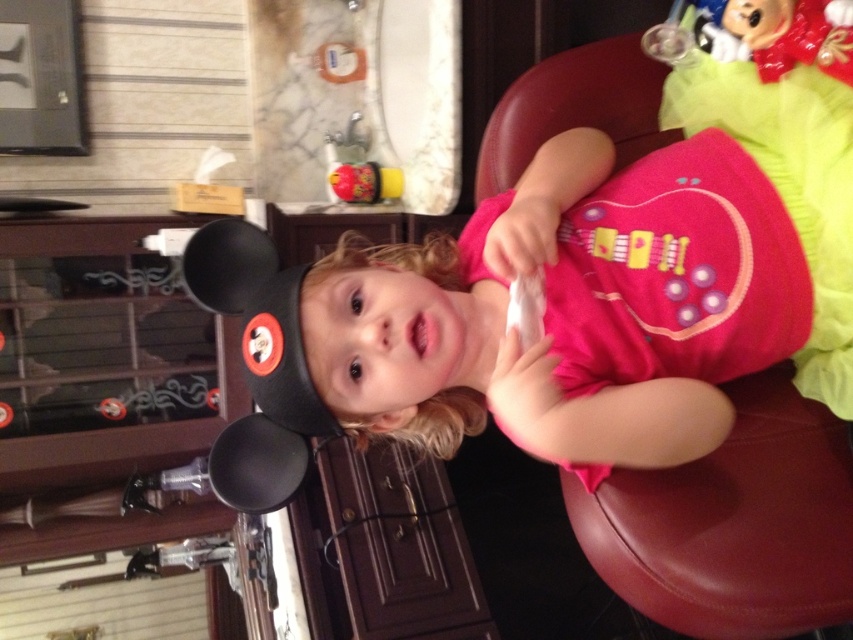
You are designing a layout for a childrens playroom. You have a leather at right and a shiny plastic toy at center. Which object requires more horizontal space to accommodate its width?

The leather at right requires more horizontal space because its width surpasses that of the shiny plastic toy at center.

Based on the scene description, can you determine if the leather at right is supporting the blonde curly hair at center?

The leather at right is positioned under blonde curly hair at center, so yes, the leather at right is supporting the blonde curly hair at center.